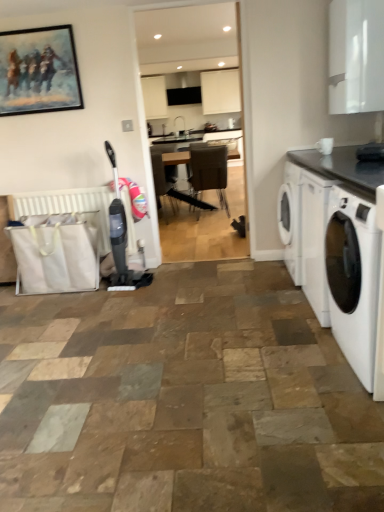
What is the approximate height of brown leather chair at center?

brown leather chair at center is 35.75 inches tall.

This screenshot has height=512, width=384. Find the location of `white fabric radiator at lower left`. white fabric radiator at lower left is located at coordinates (67, 206).

Where is `oil painting at upper left`? oil painting at upper left is located at coordinates (39, 71).

What do you see at coordinates (353, 278) in the screenshot?
I see `white glossy washing machine at right` at bounding box center [353, 278].

Image resolution: width=384 pixels, height=512 pixels. I want to click on brown leather chair at center, so (209, 170).

Find the location of `chair below the black granite countertop at right (from a real-world perspective)`. chair below the black granite countertop at right (from a real-world perspective) is located at coordinates (209, 170).

Is point (197, 165) less distant than point (309, 158)?

No, (197, 165) is behind (309, 158).

From the image's perspective, is brown leather chair at center above or below black granite countertop at right?

brown leather chair at center is situated higher than black granite countertop at right in the image.

In the scene shown: In terms of size, does brown leather chair at center appear bigger or smaller than black granite countertop at right?

brown leather chair at center is bigger than black granite countertop at right.

From a real-world perspective, relative to white fabric radiator at lower left, is white glossy washing machine at right vertically above or below?

white glossy washing machine at right is situated lower than white fabric radiator at lower left in the real world.

Is white glossy washing machine at right not inside white fabric radiator at lower left?

Absolutely, white glossy washing machine at right is external to white fabric radiator at lower left.

Can you see white glossy washing machine at right touching white fabric radiator at lower left?

No, white glossy washing machine at right is not touching white fabric radiator at lower left.

Is point (353, 153) farther from viewer compared to point (203, 173)?

No, it is in front of (203, 173).

Between black granite countertop at right and brown leather chair at center, which one has larger width?

With larger width is brown leather chair at center.

Is black granite countertop at right not inside brown leather chair at center?

Yes, black granite countertop at right is outside of brown leather chair at center.

Where is `countertop on the right of white fabric radiator at lower left`? The width and height of the screenshot is (384, 512). countertop on the right of white fabric radiator at lower left is located at coordinates (341, 166).

In the scene shown: Considering the sizes of objects white fabric radiator at lower left and black granite countertop at right in the image provided, who is taller, white fabric radiator at lower left or black granite countertop at right?

Standing taller between the two is white fabric radiator at lower left.

Which is in front, point (124, 202) or point (347, 175)?

Point (347, 175)

Is white fabric radiator at lower left turned away from black granite countertop at right?

No, white fabric radiator at lower left is not facing the opposite direction of black granite countertop at right.

Which is in front, point (40, 48) or point (333, 242)?

The point (333, 242) is closer.

Image resolution: width=384 pixels, height=512 pixels. In the image, there is a white glossy washing machine at right. In order to click on picture frame above it (from the image's perspective) in this screenshot , I will do `click(39, 71)`.

From a real-world perspective, is oil painting at upper left physically above white glossy washing machine at right?

Yes, from a real-world perspective, oil painting at upper left is over white glossy washing machine at right

The image size is (384, 512). I want to click on countertop to the right of white fabric radiator at lower left, so click(341, 166).

Is black granite countertop at right surrounding white fabric radiator at lower left?

No, white fabric radiator at lower left is located outside of black granite countertop at right.

Does point (306, 167) come farther from viewer compared to point (43, 193)?

That is False.

Is black granite countertop at right to the right of white fabric radiator at lower left from the viewer's perspective?

Correct, you'll find black granite countertop at right to the right of white fabric radiator at lower left.

How many degrees apart are the facing directions of white fabric radiator at lower left and brown leather chair at center?

179 degrees separate the facing orientations of white fabric radiator at lower left and brown leather chair at center.

From the image's perspective, which one is positioned higher, white fabric radiator at lower left or brown leather chair at center?

From the image's view, brown leather chair at center is above.

Where is `radiator in front of the brown leather chair at center`? Image resolution: width=384 pixels, height=512 pixels. radiator in front of the brown leather chair at center is located at coordinates (67, 206).

Between white fabric radiator at lower left and brown leather chair at center, which one has less height?

white fabric radiator at lower left is shorter.

The width and height of the screenshot is (384, 512). Find the location of `chair on the left of black granite countertop at right`. chair on the left of black granite countertop at right is located at coordinates (209, 170).

The width and height of the screenshot is (384, 512). In the image, there is a white glossy washing machine at right. In order to click on radiator above it (from the image's perspective) in this screenshot , I will do `click(67, 206)`.

Consider the image. Looking at the image, which one is located closer to white glossy washing machine at right, oil painting at upper left or brown leather chair at center?

oil painting at upper left is closer to white glossy washing machine at right.

From the picture: From the image, which object appears to be farther from black granite countertop at right, white fabric radiator at lower left or brown leather chair at center?

Based on the image, brown leather chair at center appears to be further to black granite countertop at right.

Estimate the real-world distances between objects in this image. Which object is closer to brown leather chair at center, white glossy washing machine at right or black granite countertop at right?

The object closer to brown leather chair at center is black granite countertop at right.

Looking at this image, which object lies nearer to the anchor point brown leather chair at center, white fabric radiator at lower left or oil painting at upper left?

white fabric radiator at lower left is positioned closer to the anchor brown leather chair at center.

Looking at the image, which one is located further to brown leather chair at center, black granite countertop at right or white fabric radiator at lower left?

Among the two, black granite countertop at right is located further to brown leather chair at center.

When comparing their distances from white fabric radiator at lower left, does oil painting at upper left or white glossy washing machine at right seem further?

Among the two, white glossy washing machine at right is located further to white fabric radiator at lower left.

Which object lies further to the anchor point oil painting at upper left, white fabric radiator at lower left or black granite countertop at right?

The object further to oil painting at upper left is black granite countertop at right.

Looking at this image, which object lies nearer to the anchor point black granite countertop at right, white glossy washing machine at right or white fabric radiator at lower left?

Among the two, white glossy washing machine at right is located nearer to black granite countertop at right.

You are a GUI agent. You are given a task and a screenshot of the screen. Output one action in this format:
    pyautogui.click(x=<x>, y=<y>)
    Task: Click on the picture frame positioned between black granite countertop at right and brown leather chair at center from near to far
    The height and width of the screenshot is (512, 384).
    Given the screenshot: What is the action you would take?
    pyautogui.click(x=39, y=71)

The height and width of the screenshot is (512, 384). What are the coordinates of `radiator positioned between oil painting at upper left and brown leather chair at center from near to far` in the screenshot? It's located at (67, 206).

Locate an element on the screen. The image size is (384, 512). washing machine located between black granite countertop at right and brown leather chair at center in the depth direction is located at coordinates (353, 278).

You are a GUI agent. You are given a task and a screenshot of the screen. Output one action in this format:
    pyautogui.click(x=<x>, y=<y>)
    Task: Click on the washing machine between oil painting at upper left and black granite countertop at right
    
    Given the screenshot: What is the action you would take?
    pyautogui.click(x=353, y=278)